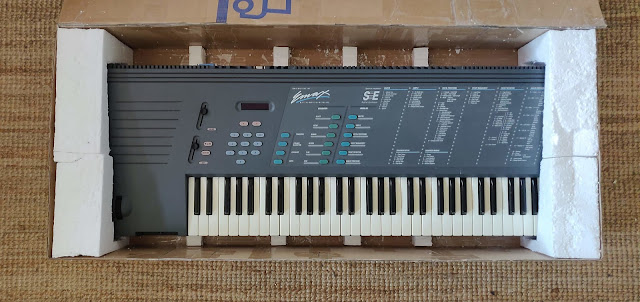
Locate an element on the screen. floor is located at coordinates (612, 278).